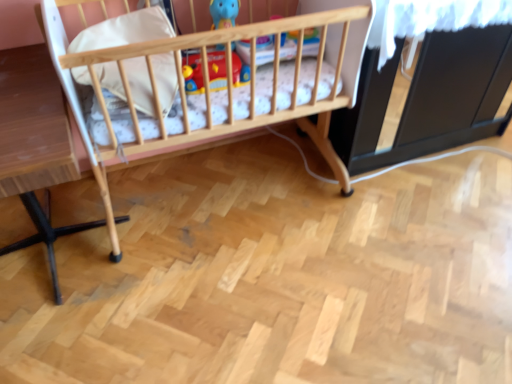
Question: Is point (224, 13) positioned closer to the camera than point (31, 87)?

Choices:
 (A) farther
 (B) closer

Answer: (A)

Question: Looking at their shapes, would you say matte plastic toy at center is wider or thinner than light brown wooden table at left?

Choices:
 (A) wide
 (B) thin

Answer: (B)

Question: Estimate the real-world distances between objects in this image. Which object is farther from the wooden crib at center?

Choices:
 (A) white soft pillow at upper left
 (B) matte plastic toy at center
 (C) light brown wooden table at left

Answer: (C)

Question: Estimate the real-world distances between objects in this image. Which object is farther from the wooden crib at center?

Choices:
 (A) white soft pillow at upper left
 (B) matte plastic toy at center
 (C) light brown wooden table at left

Answer: (C)